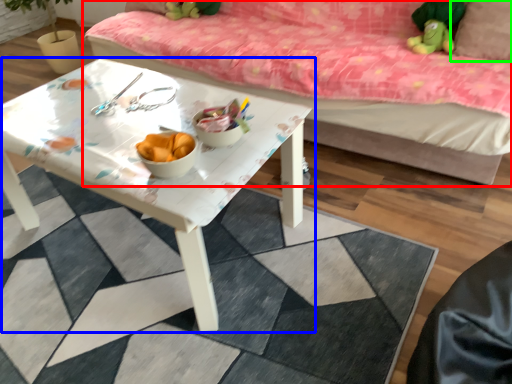
Question: Which object is the farthest from studio couch (highlighted by a red box)? Choose among these: table (highlighted by a blue box) or pillow (highlighted by a green box).

Choices:
 (A) table
 (B) pillow

Answer: (B)